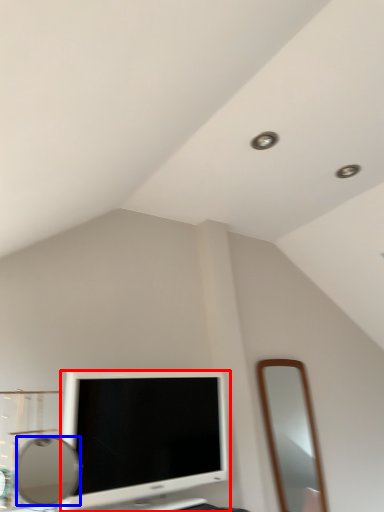
Question: Which point is closer to the camera, television (highlighted by a red box) or mirror (highlighted by a blue box)?

Choices:
 (A) television
 (B) mirror

Answer: (B)